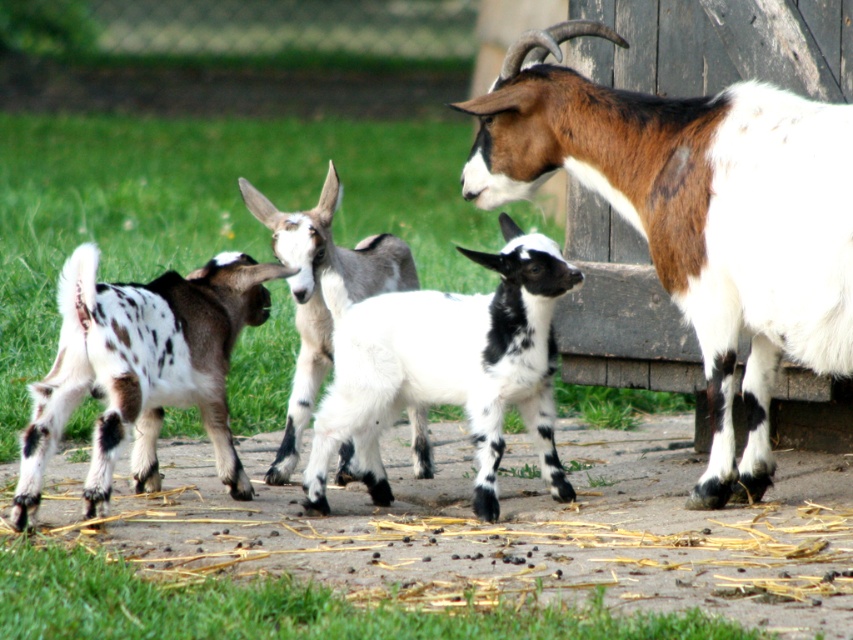
You are a farmer checking the goats in the pasture. You notice the brown and white fur at right and the spotted fur kid goat at left. Which one is larger in size?

The brown and white fur at right is bigger than the spotted fur kid goat at left.

You are a farmer checking the goats in your pasture. You notice the spotted fur kid goat at left and the spotted fur goat at center. Which goat is wider?

The spotted fur kid goat at left is wider than the spotted fur goat at center.